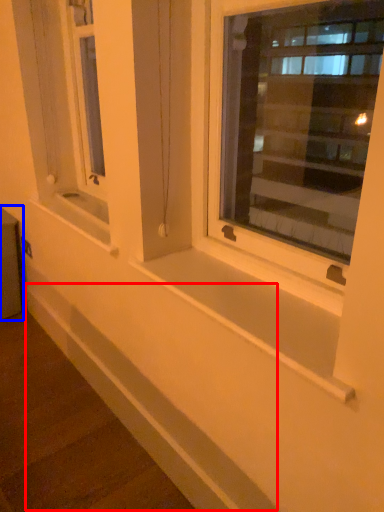
Question: Which point is further to the camera, ledge (highlighted by a red box) or window box (highlighted by a blue box)?

Choices:
 (A) ledge
 (B) window box

Answer: (B)